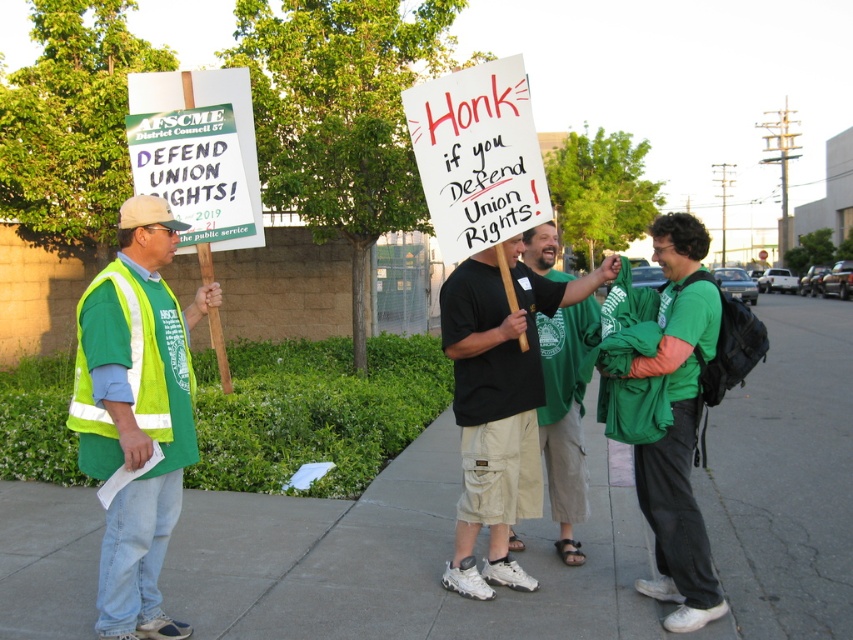
Question: Does green fabric shirt at center lie in front of green cardboard sign at left?

Choices:
 (A) no
 (B) yes

Answer: (B)

Question: Estimate the real-world distances between objects in this image. Which object is farther from the reflective yellow vest at left?

Choices:
 (A) green cardboard sign at left
 (B) white paper sign at center
 (C) green fabric shirt at center

Answer: (C)

Question: Which object is farther from the camera taking this photo?

Choices:
 (A) green cardboard sign at left
 (B) black cotton t-shirt at center
 (C) green fabric shirt at center
 (D) concrete sidewalk at center

Answer: (A)

Question: Does green cardboard sign at left come in front of green reflective safety vest at left?

Choices:
 (A) no
 (B) yes

Answer: (A)

Question: Does reflective yellow vest at left come in front of green reflective safety vest at left?

Choices:
 (A) yes
 (B) no

Answer: (B)

Question: Which point appears closest to the camera in this image?

Choices:
 (A) (531, 374)
 (B) (828, 536)

Answer: (A)